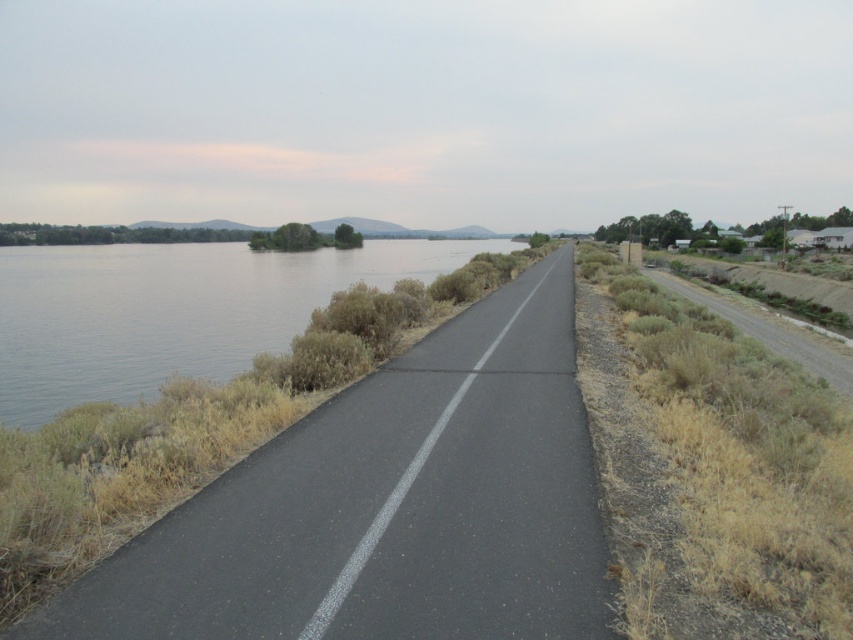
Question: Which object is positioned farthest from the clear water at left?

Choices:
 (A) black asphalt road at center
 (B) dry grass at right

Answer: (A)

Question: Which object appears farthest from the camera in this image?

Choices:
 (A) dry grass at right
 (B) black asphalt road at center
 (C) clear water at left

Answer: (A)

Question: Can you confirm if clear water at left is positioned above dry grass at right?

Choices:
 (A) yes
 (B) no

Answer: (A)

Question: Does black asphalt road at center appear over dry grass at right?

Choices:
 (A) yes
 (B) no

Answer: (B)

Question: Does clear water at left appear over dry grass at right?

Choices:
 (A) yes
 (B) no

Answer: (A)

Question: Which of the following is the closest to the observer?

Choices:
 (A) (515, 445)
 (B) (222, 289)

Answer: (A)